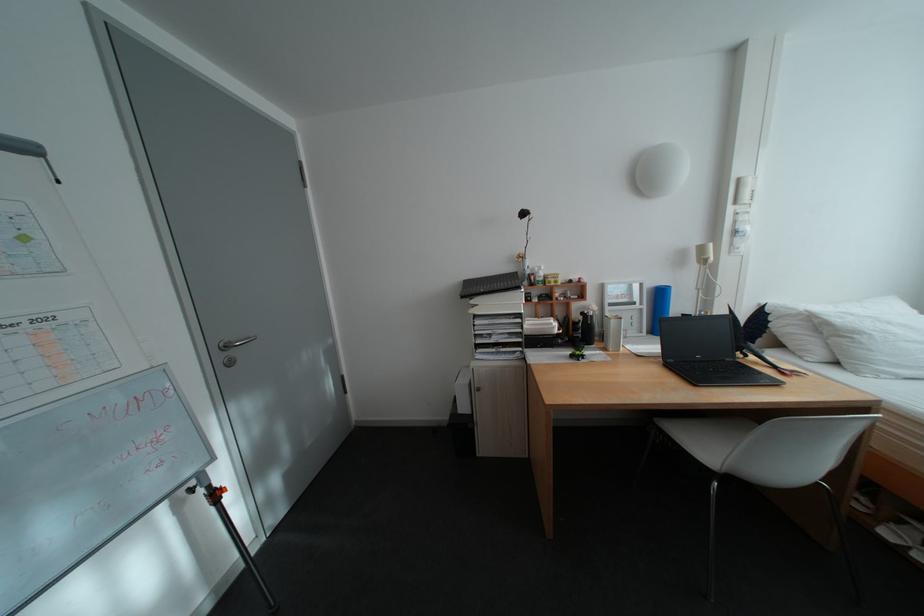
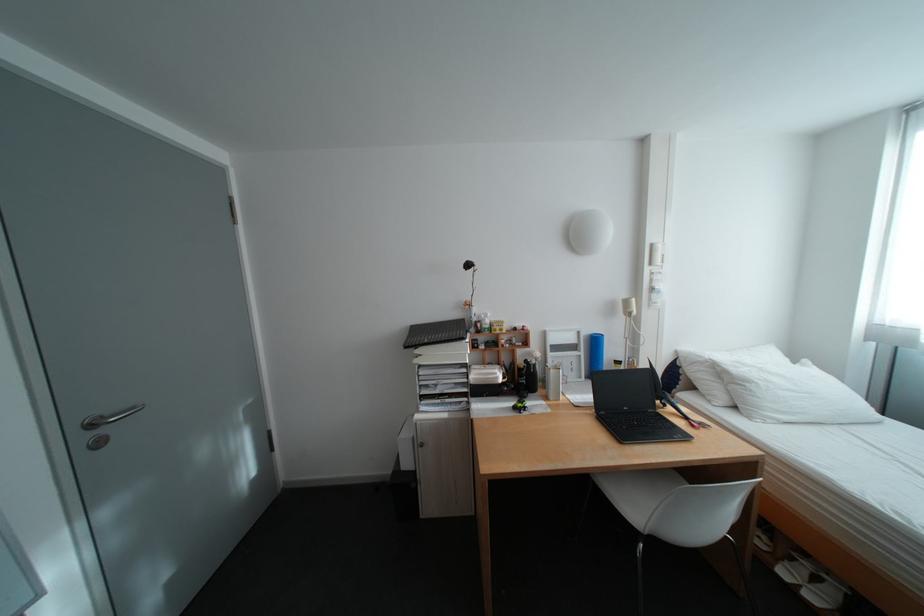
The point at (657, 307) is marked in the first image. Where is the corresponding point in the second image?

(594, 354)